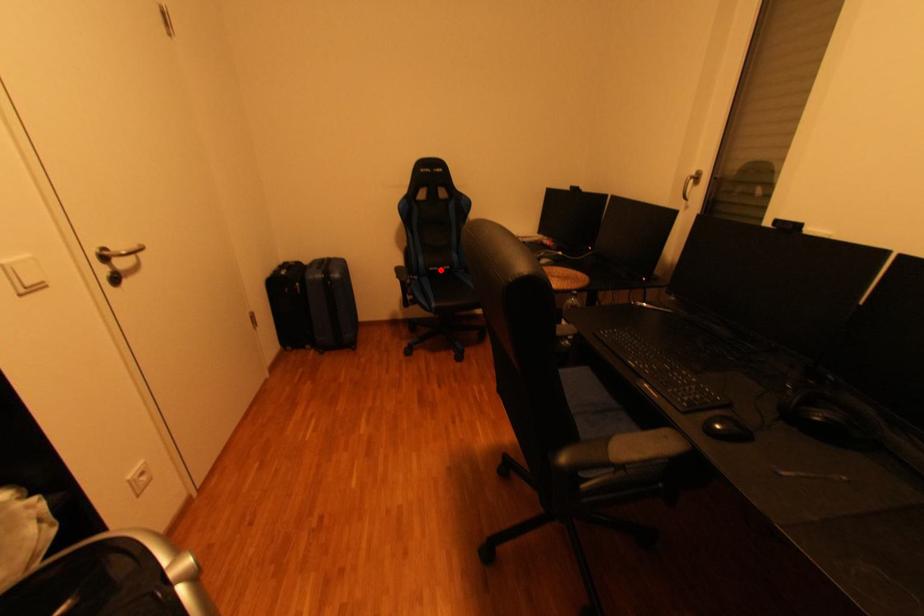
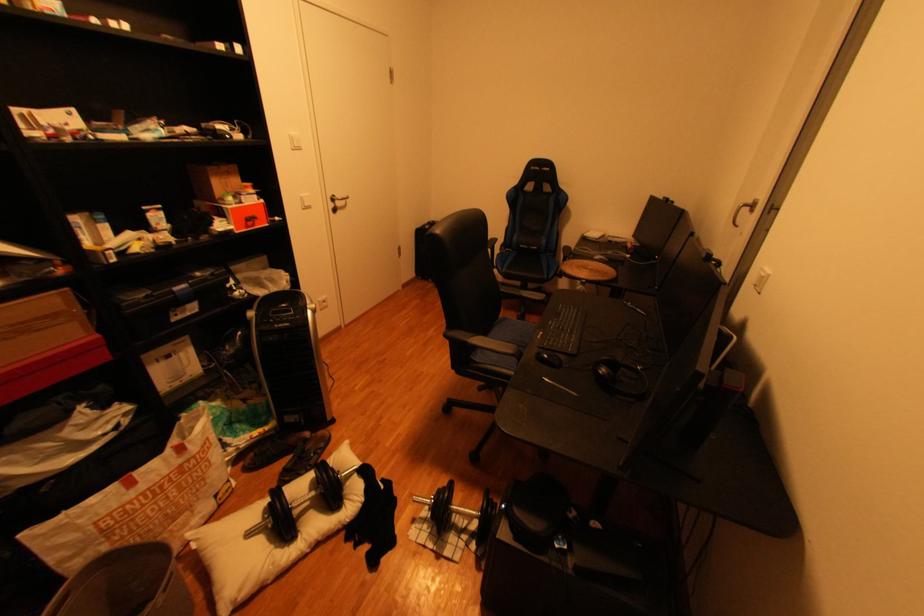
Question: A red point is marked in image1. In image2, is the corresponding 3D point closer to the camera or farther? Reply with the corresponding letter.

Choices:
 (A) The corresponding 3D point is closer.
 (B) The corresponding 3D point is farther.

Answer: (A)